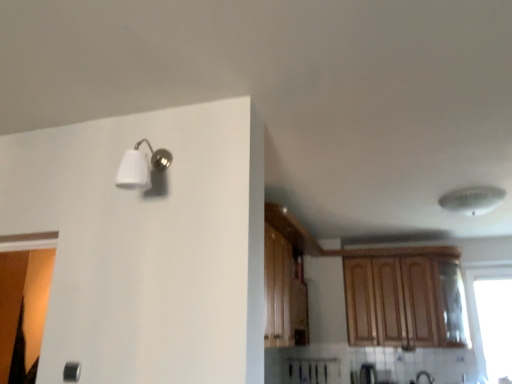
Question: Is wooden cabinet at upper right situated inside transparent glass window at right or outside?

Choices:
 (A) outside
 (B) inside

Answer: (A)

Question: Visually, is wooden cabinet at upper right positioned to the left or to the right of transparent glass window at right?

Choices:
 (A) left
 (B) right

Answer: (A)

Question: Based on their relative distances, which object is farther from the transparent glass window at right?

Choices:
 (A) white matte light fixture at upper left
 (B) white plastic ceiling fan at upper right
 (C) wooden cabinet at upper right

Answer: (A)

Question: Which of these objects is positioned closest to the white matte light fixture at upper left?

Choices:
 (A) wooden cabinet at upper right
 (B) transparent glass window at right
 (C) white plastic ceiling fan at upper right

Answer: (C)